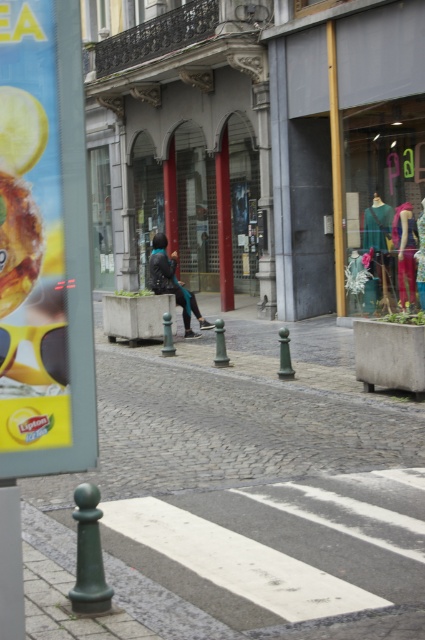
Question: Which point appears farthest from the camera in this image?

Choices:
 (A) (10, 26)
 (B) (399, 296)
 (C) (189, 291)
 (D) (359, 154)

Answer: (C)

Question: Which object is farther from the camera taking this photo?

Choices:
 (A) matte black jacket at center
 (B) cobblestone pavement at center
 (C) yellow plastic sign at left
 (D) multicolored fabric dress at center right

Answer: (A)

Question: Does cobblestone pavement at center come behind yellow plastic sign at left?

Choices:
 (A) yes
 (B) no

Answer: (A)

Question: Is transparent glass mannequins at center smaller than multicolored fabric dress at center right?

Choices:
 (A) yes
 (B) no

Answer: (B)

Question: Considering the relative positions of transparent glass mannequins at center and matte black jacket at center in the image provided, where is transparent glass mannequins at center located with respect to matte black jacket at center?

Choices:
 (A) left
 (B) right

Answer: (B)

Question: Which object is farther from the camera taking this photo?

Choices:
 (A) yellow plastic sign at left
 (B) cobblestone pavement at center
 (C) multicolored fabric dress at center right

Answer: (C)